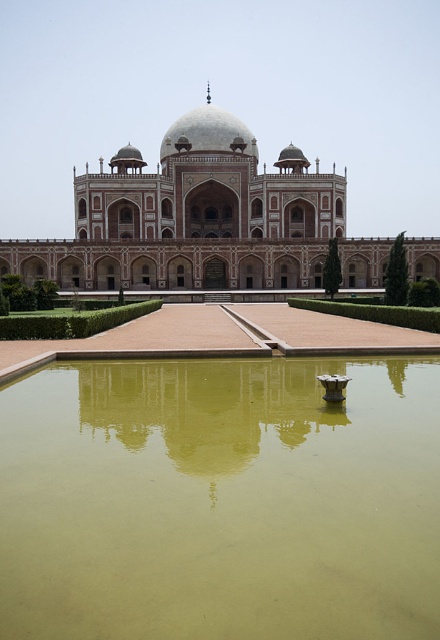
From the picture: You are standing at the entrance of the monument and want to reach the point marked as point (99, 160). There is an obstacle at point (299, 394). Will you encounter this obstacle on your way?

Point (299, 394) is in front of point (99, 160), so yes, you will encounter the obstacle at point (299, 394) on your way to point (99, 160).

You are a visitor standing at the entrance of the white marble palace at center. You notice a green murky water at center in front of you. Which object appears narrower from your perspective?

The green murky water at center appears narrower than the white marble palace at center from your perspective.

You are a visitor standing at the garden entrance and see the green murky water at center and the white marble palace at center. Which object appears larger in the scene?

The white marble palace at center appears larger than the green murky water at center because the green murky water at center has a smaller size compared to white marble palace at center.